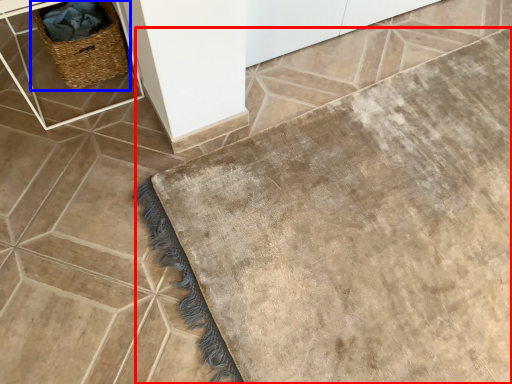
Question: Which object is further to the camera taking this photo, bath mat (highlighted by a red box) or picnic basket (highlighted by a blue box)?

Choices:
 (A) bath mat
 (B) picnic basket

Answer: (B)